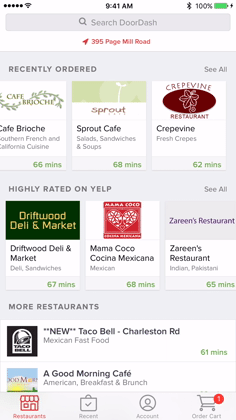
Identify the location of restaurants. (34, 405).